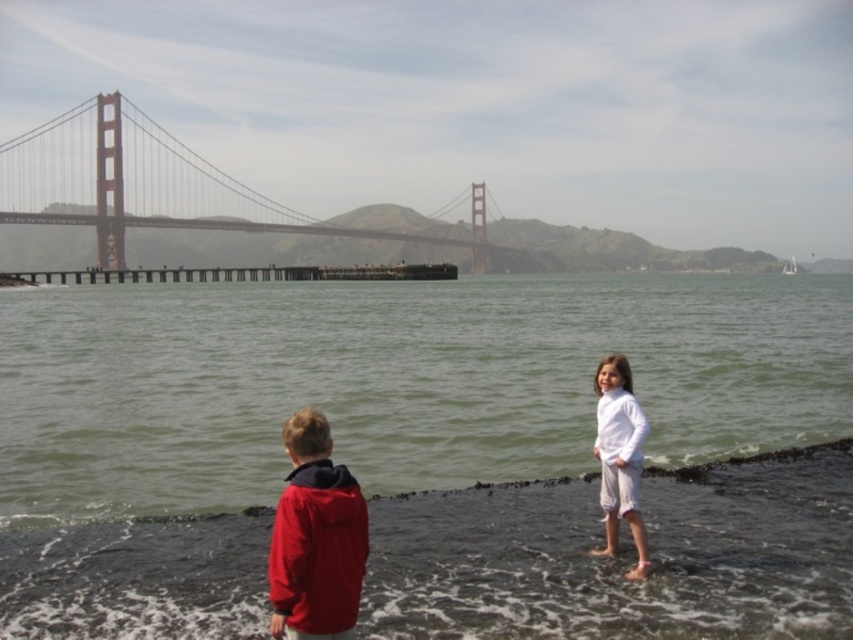
Question: Does matte red jacket at lower left lie in front of white cotton pants at right?

Choices:
 (A) no
 (B) yes

Answer: (B)

Question: Which object appears closest to the camera in this image?

Choices:
 (A) white cotton pants at right
 (B) greenish water at lower center
 (C) matte red jacket at lower left

Answer: (C)

Question: Is greenish water at lower center smaller than white cotton pants at right?

Choices:
 (A) no
 (B) yes

Answer: (A)

Question: Does metallic bridge at upper center have a smaller size compared to matte red jacket at lower left?

Choices:
 (A) no
 (B) yes

Answer: (A)

Question: Among these points, which one is farthest from the camera?

Choices:
 (A) (477, 244)
 (B) (564, 339)
 (C) (300, 493)
 (D) (624, 500)

Answer: (A)

Question: Which object appears farthest from the camera in this image?

Choices:
 (A) matte red jacket at lower left
 (B) metallic bridge at upper center
 (C) greenish water at lower center

Answer: (B)